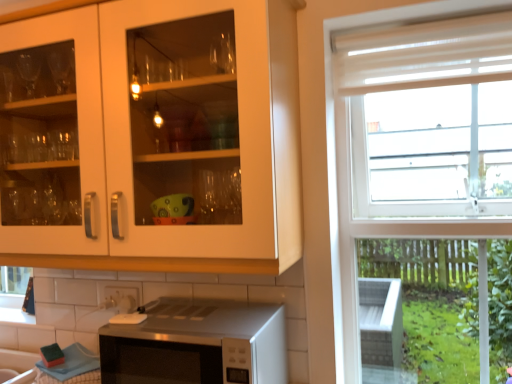
Question: Considering the relative sizes of sheer white curtain at upper right and matte white cabinet at upper left in the image provided, is sheer white curtain at upper right thinner than matte white cabinet at upper left?

Choices:
 (A) no
 (B) yes

Answer: (B)

Question: Is matte white cabinet at upper left at the back of sheer white curtain at upper right?

Choices:
 (A) no
 (B) yes

Answer: (A)

Question: From the image's perspective, is sheer white curtain at upper right located above matte white cabinet at upper left?

Choices:
 (A) no
 (B) yes

Answer: (B)

Question: From a real-world perspective, is sheer white curtain at upper right physically below matte white cabinet at upper left?

Choices:
 (A) yes
 (B) no

Answer: (B)

Question: Is sheer white curtain at upper right located outside matte white cabinet at upper left?

Choices:
 (A) no
 (B) yes

Answer: (B)

Question: Does sheer white curtain at upper right have a greater width compared to matte white cabinet at upper left?

Choices:
 (A) no
 (B) yes

Answer: (A)

Question: From the image's perspective, is matte white cabinet at upper left beneath white glossy tile at lower center?

Choices:
 (A) no
 (B) yes

Answer: (A)

Question: Does matte white cabinet at upper left have a lesser width compared to white glossy tile at lower center?

Choices:
 (A) no
 (B) yes

Answer: (A)

Question: Does matte white cabinet at upper left appear on the right side of white glossy tile at lower center?

Choices:
 (A) no
 (B) yes

Answer: (B)

Question: Is matte white cabinet at upper left closer to camera compared to white glossy tile at lower center?

Choices:
 (A) no
 (B) yes

Answer: (B)

Question: Considering the relative sizes of matte white cabinet at upper left and white glossy tile at lower center in the image provided, is matte white cabinet at upper left smaller than white glossy tile at lower center?

Choices:
 (A) no
 (B) yes

Answer: (A)

Question: Considering the relative positions of matte white cabinet at upper left and white glossy tile at lower center in the image provided, is matte white cabinet at upper left to the left of white glossy tile at lower center from the viewer's perspective?

Choices:
 (A) yes
 (B) no

Answer: (B)

Question: Is satin silver microwave at lower center in front of matte white cabinet at upper left?

Choices:
 (A) yes
 (B) no

Answer: (B)